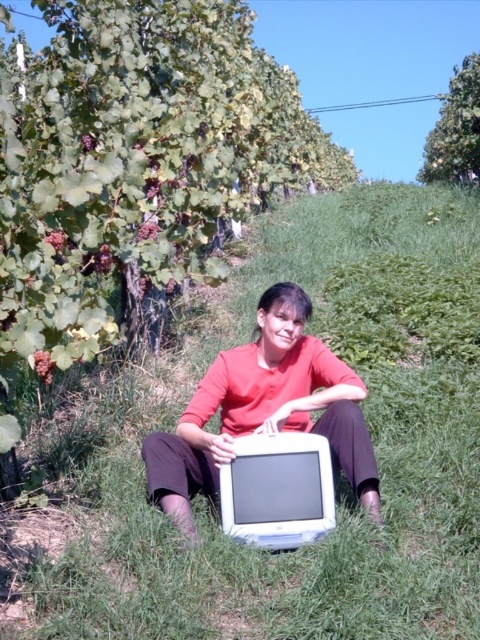
Question: Which of the following is the farthest from the observer?

Choices:
 (A) (199, 467)
 (B) (425, 198)

Answer: (B)

Question: Which of the following is the farthest from the observer?

Choices:
 (A) (362, 436)
 (B) (398, 497)

Answer: (B)

Question: Is green grassy at center positioned before matte white monitor at center?

Choices:
 (A) yes
 (B) no

Answer: (A)

Question: Can you confirm if green grassy at center is smaller than matte white monitor at center?

Choices:
 (A) yes
 (B) no

Answer: (B)

Question: Observing the image, what is the correct spatial positioning of green grassy at center in reference to matte white monitor at center?

Choices:
 (A) right
 (B) left

Answer: (A)